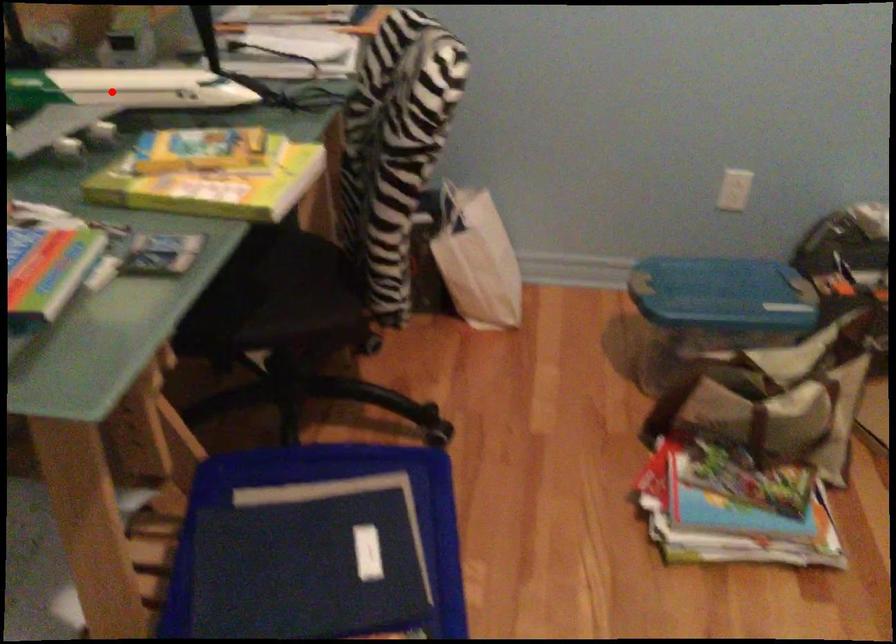
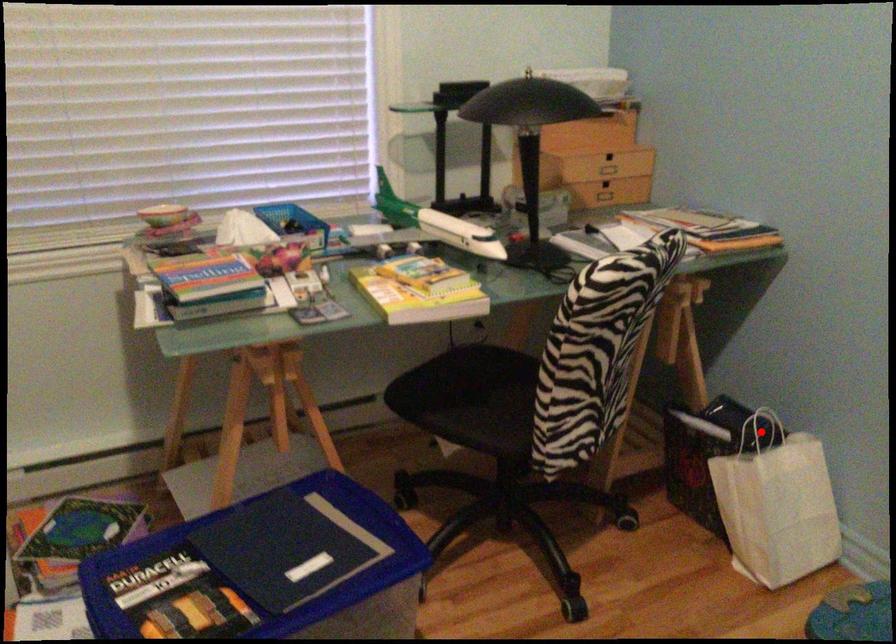
I am providing you with two images of the same scene from different viewpoints. A red point is marked on the first image and another point is marked on the second image. Do the highlighted points in image1 and image2 indicate the same real-world spot?

No